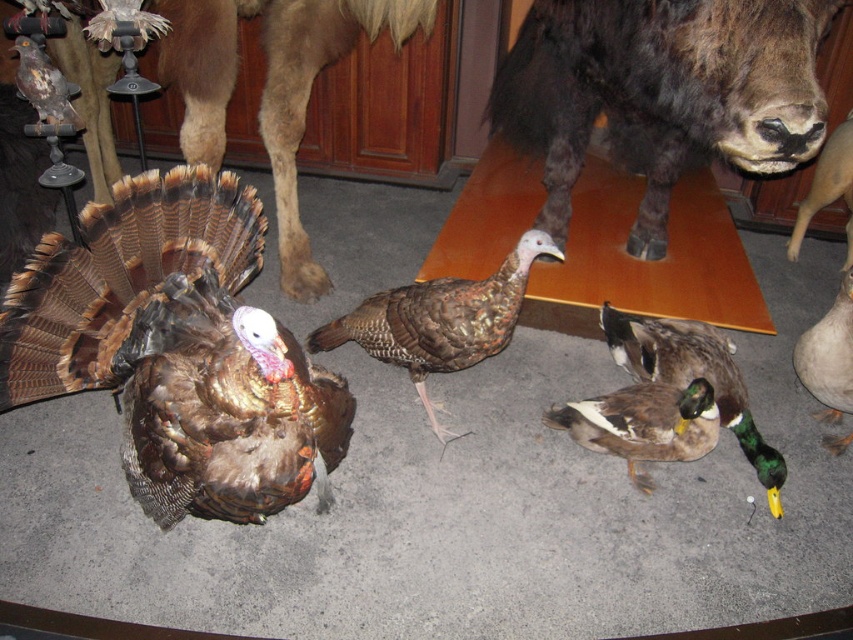
Question: Considering the relative positions of shiny brown turkey at center and dark brown fur at upper right in the image provided, where is shiny brown turkey at center located with respect to dark brown fur at upper right?

Choices:
 (A) left
 (B) right

Answer: (A)

Question: Which point appears farthest from the camera in this image?

Choices:
 (A) (779, 13)
 (B) (844, 449)

Answer: (B)

Question: Does green glossy duck at lower right appear over shiny brown turkey at upper left?

Choices:
 (A) yes
 (B) no

Answer: (B)

Question: Which is nearer to the shiny brown turkey at upper left?

Choices:
 (A) dark brown fur at upper right
 (B) green glossy duck at lower right
 (C) shiny brown turkey at center

Answer: (C)

Question: Which object is positioned closest to the dark brown fur at upper right?

Choices:
 (A) shiny brown turkey at center
 (B) shiny brown turkey at upper left

Answer: (A)

Question: Is dark brown fur at upper right positioned in front of brown matte turkey at center?

Choices:
 (A) yes
 (B) no

Answer: (A)